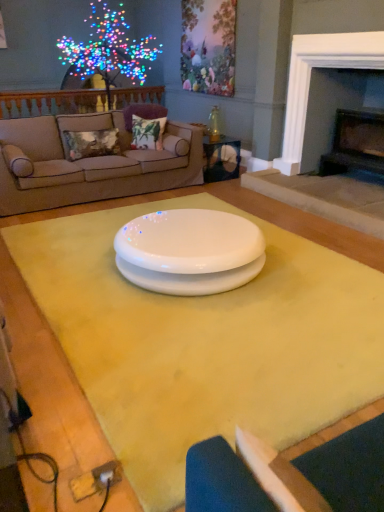
Question: Would you say white glossy plate at center contains yellow matte table at center, the 2th table positioned from the top?

Choices:
 (A) yes
 (B) no

Answer: (B)

Question: Is white glossy plate at center smaller than yellow matte table at center, the 2th table positioned from the top?

Choices:
 (A) no
 (B) yes

Answer: (A)

Question: Is there a large distance between white glossy plate at center and yellow matte table at center, arranged as the 1th table when ordered from the bottom?

Choices:
 (A) yes
 (B) no

Answer: (B)

Question: From the image's perspective, is white glossy plate at center on top of yellow matte table at center, the second table from the back?

Choices:
 (A) no
 (B) yes

Answer: (B)

Question: From a real-world perspective, is white glossy plate at center located higher than yellow matte table at center, arranged as the 1th table when ordered from the bottom?

Choices:
 (A) yes
 (B) no

Answer: (A)

Question: Considering the positions of white glossy plate at center and yellow matte table at center, the 2th table positioned from the top, in the image, is white glossy plate at center bigger or smaller than yellow matte table at center, the 2th table positioned from the top,?

Choices:
 (A) big
 (B) small

Answer: (A)

Question: From a real-world perspective, is white glossy plate at center physically located above or below yellow matte table at center, the first table when ordered from front to back?

Choices:
 (A) above
 (B) below

Answer: (A)

Question: Considering the positions of point (178, 242) and point (251, 396), is point (178, 242) closer or farther from the camera than point (251, 396)?

Choices:
 (A) farther
 (B) closer

Answer: (A)

Question: Looking at their shapes, would you say white glossy plate at center is wider or thinner than yellow matte table at center, arranged as the 1th table when ordered from the bottom?

Choices:
 (A) thin
 (B) wide

Answer: (A)

Question: From a real-world perspective, is white glossy plate at center physically located above or below black stone fireplace at right, which is counted as the 2th fireplace, starting from the left?

Choices:
 (A) below
 (B) above

Answer: (A)

Question: Is point (208, 289) positioned closer to the camera than point (362, 150)?

Choices:
 (A) closer
 (B) farther

Answer: (A)

Question: In terms of height, does white glossy plate at center look taller or shorter compared to black stone fireplace at right, which is counted as the 2th fireplace, starting from the left?

Choices:
 (A) short
 (B) tall

Answer: (A)

Question: Considering the positions of white glossy plate at center and black stone fireplace at right, which is counted as the 2th fireplace, starting from the left, in the image, is white glossy plate at center wider or thinner than black stone fireplace at right, which is counted as the 2th fireplace, starting from the left,?

Choices:
 (A) thin
 (B) wide

Answer: (B)

Question: Which is correct: white fabric armchair at lower right is inside illuminated plastic tree at upper left, or outside of it?

Choices:
 (A) inside
 (B) outside

Answer: (B)

Question: Is white fabric armchair at lower right to the left or to the right of illuminated plastic tree at upper left in the image?

Choices:
 (A) right
 (B) left

Answer: (A)